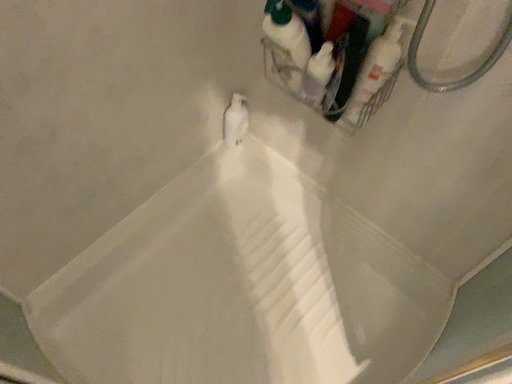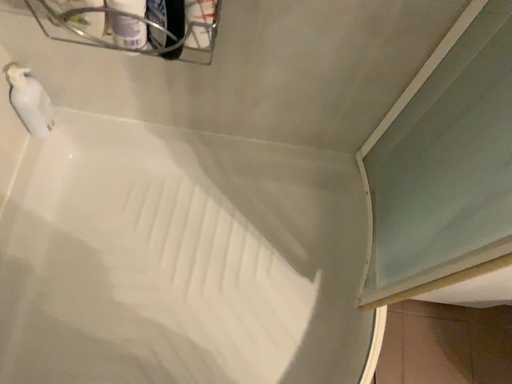
Question: How did the camera likely rotate when shooting the video?

Choices:
 (A) rotated left
 (B) rotated right

Answer: (B)